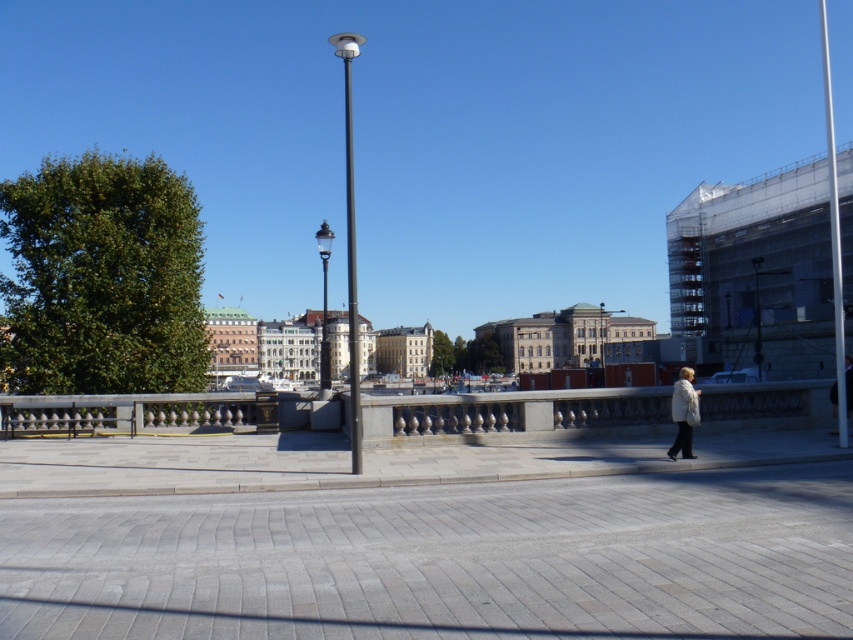
You are a delivery person carrying a white fuzzy coat at lower right and need to step onto the gray brick pavement at center. Can you place the coat on the pavement without it hanging over the edges?

The gray brick pavement at center is shorter than the white fuzzy coat at lower right, so placing the coat on the pavement may cause part of it to hang over the edges since the coat is longer than the pavement.